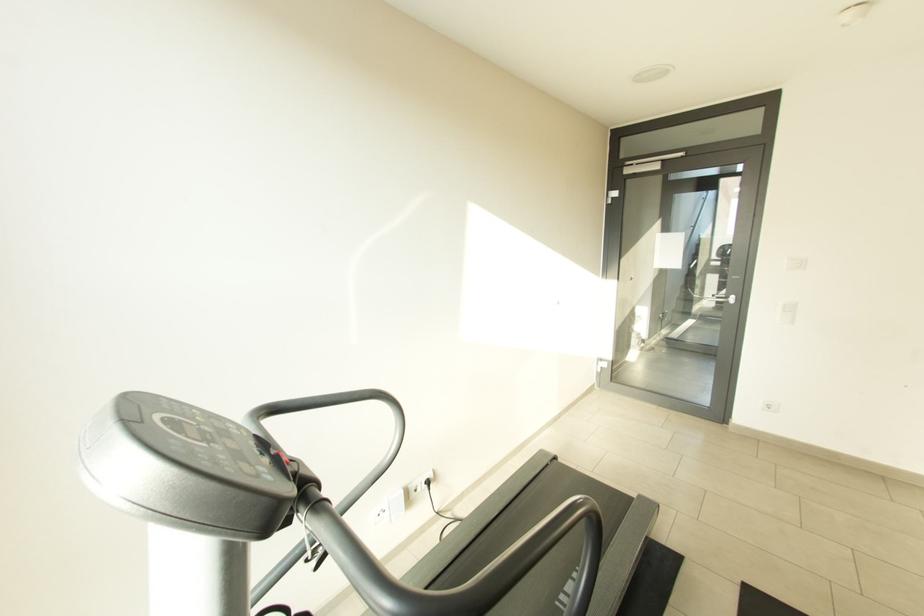
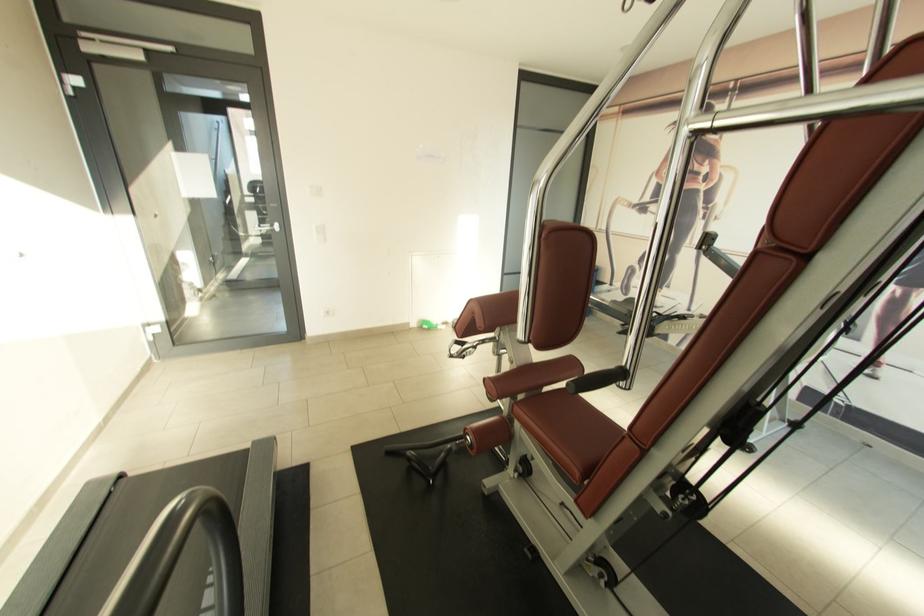
Find the pixel in the second image that matches (718,280) in the first image.

(257, 217)